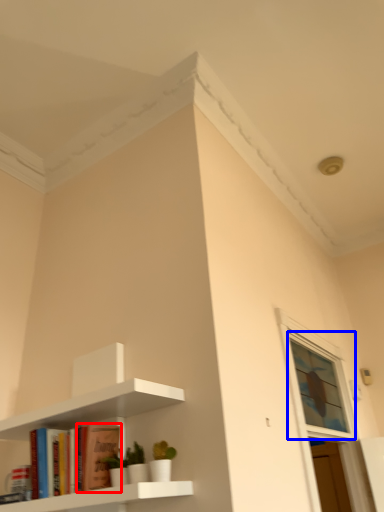
Question: Which object is closer to the camera taking this photo, book (highlighted by a red box) or window (highlighted by a blue box)?

Choices:
 (A) book
 (B) window

Answer: (A)